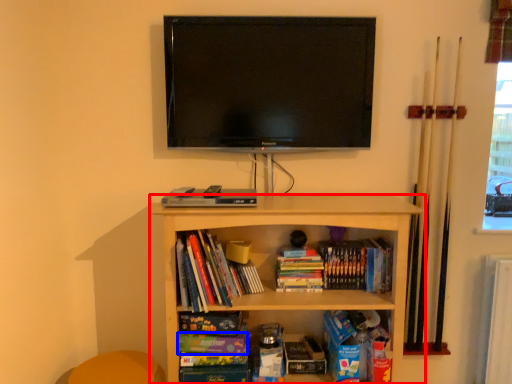
Question: Which object is further to the camera taking this photo, shelf (highlighted by a red box) or paperback book (highlighted by a blue box)?

Choices:
 (A) shelf
 (B) paperback book

Answer: (B)